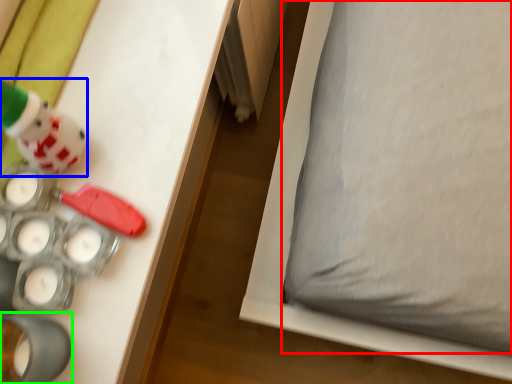
Question: Considering the real-world distances, which object is farthest from pillow (highlighted by a red box)? toy (highlighted by a blue box) or toy (highlighted by a green box)?

Choices:
 (A) toy
 (B) toy

Answer: (B)